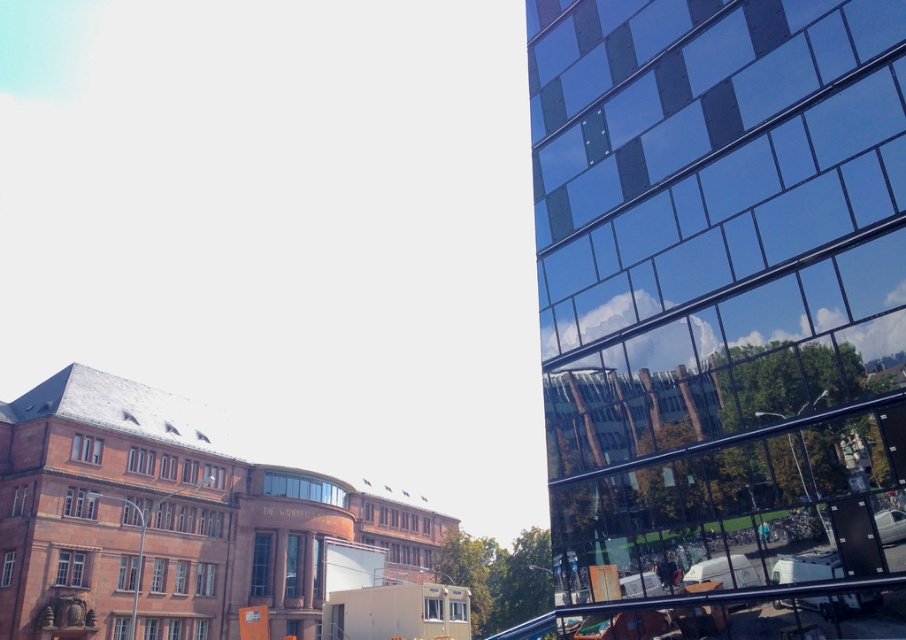
You are an architect analyzing the urban space. You notice the reflective glass building at right and the black glossy rail at lower right. Which object occupies a larger area in the image?

The black glossy rail at lower right is larger in size compared to the reflective glass building at right, so the black glossy rail at lower right occupies a larger area in the image.

You are a delivery person standing at the reflective glass building at right. You need to place a package on the black glossy rail at lower right. Can you reach the rail without moving from your current position?

The distance between the reflective glass building at right and the black glossy rail at lower right is 6.54 meters. Since you are at the reflective glass building at right, you would need to move 6.54 meters towards the rail to place the package, so you cannot reach it without moving.